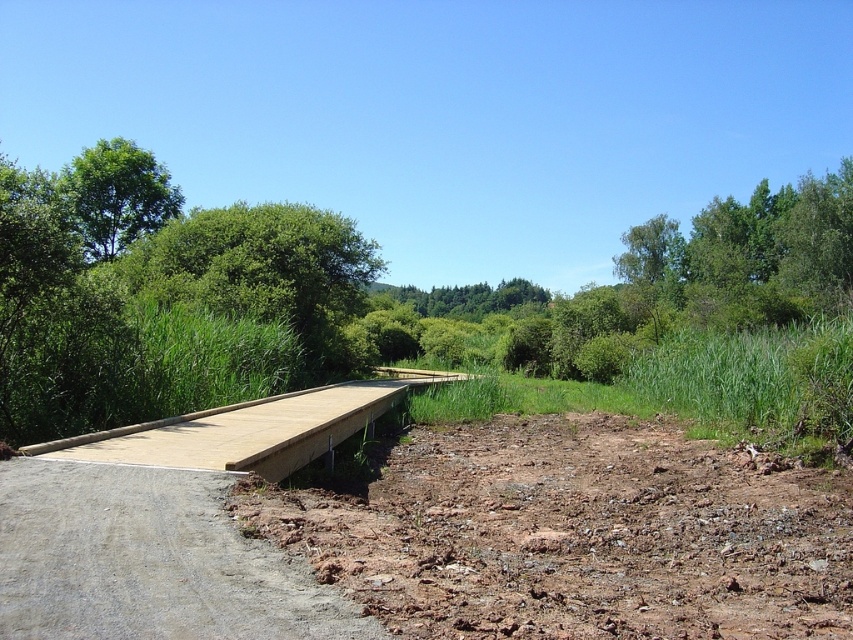
You are a construction worker trying to access the brown soil at lower right. There is a light brown wooden bridge at center nearby. Can you walk directly to the soil without stepping on the bridge?

The brown soil at lower right is positioned under the light brown wooden bridge at center, so you can access it directly by walking underneath the bridge without needing to step onto the bridge itself.

You are a gardener planning to install a new fence along the edge of the smooth concrete path at lower left and the green leafy tree at upper left. Which object requires more consideration in terms of height when designing the fence?

The green leafy tree at upper left requires more consideration in terms of height because it is taller than the smooth concrete path at lower left.

You are standing at the start of the dirt path and want to reach the paved surface to your left. Which object, the light brown wooden bridge at center or the green leafy tree at upper left, is closer to you as you walk towards the paved surface?

The light brown wooden bridge at center is closer to the viewer than the green leafy tree at upper left, so the light brown wooden bridge at center would be closer as you walk towards the paved surface.